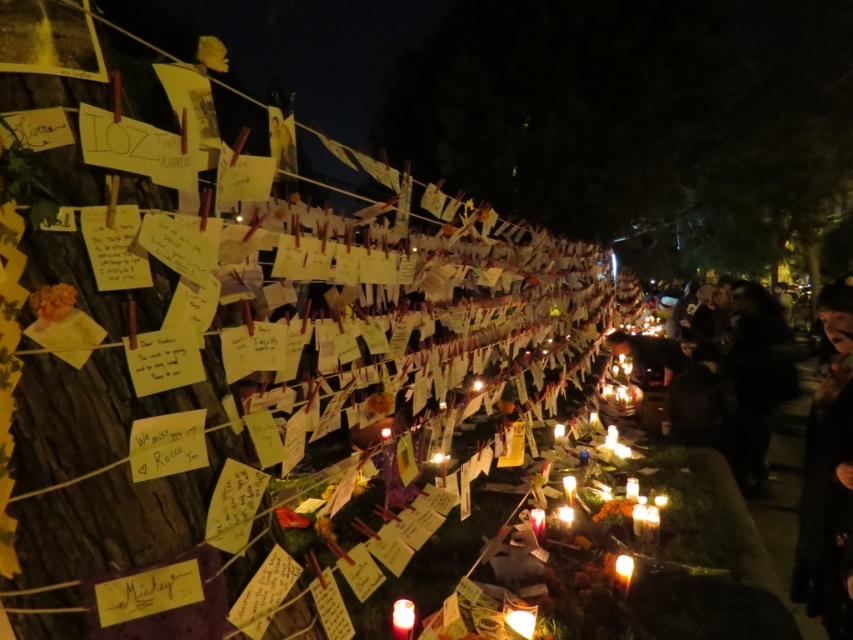
You are standing in front of the tree with the notes and want to place a new candle between the translucent wax candle at lower center and the translucent wax candle at lower right. Based on their positions, which candle should you place your new candle closer to?

The translucent wax candle at lower center is positioned on the left side of the translucent wax candle at lower right. Therefore, to place the new candle between them, you should position it closer to the translucent wax candle at lower center since it is the leftmost candle in that pair.

You are organizing a memorial event and need to place a new candle between the translucent wax candle at lower center and the translucent wax candle at lower right. Which candle should you place the new candle closer to if you want it to be the same size as the smaller one?

You should place the new candle closer to the translucent wax candle at lower center because it is smaller than the translucent wax candle at lower right.

You are a fire safety inspector checking the scene. You see the translucent wax candle at lower center and the translucent wax candle at lower right. Which one is wider?

The translucent wax candle at lower right is wider than the translucent wax candle at lower center.